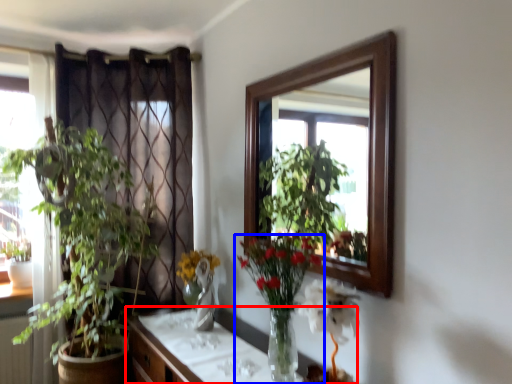
Question: Which object appears farthest to the camera in this image, cabinetry (highlighted by a red box) or houseplant (highlighted by a blue box)?

Choices:
 (A) cabinetry
 (B) houseplant

Answer: (B)